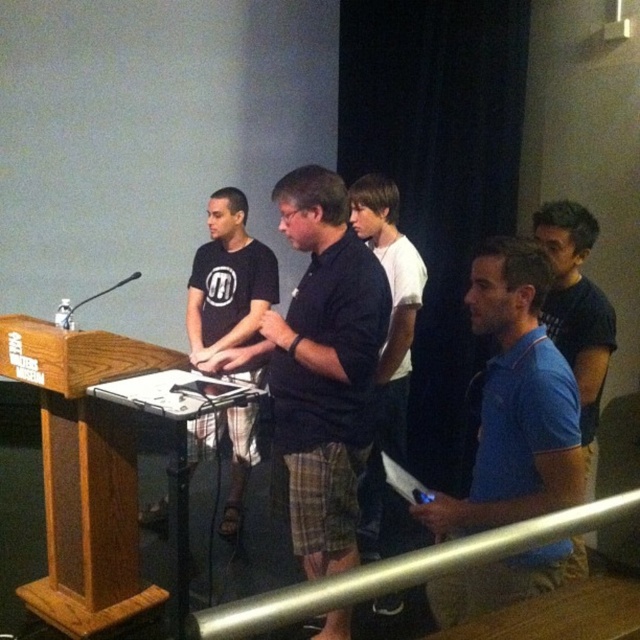
You are standing in the conference room and want to walk to the podium. There is a black cotton shirt at center and a metallic silver rail at lower center in your way. Which object is closer to you?

The black cotton shirt at center is closer to you because the metallic silver rail at lower center is behind it.

You are standing in the conference room and need to move from the entrance to the podium. There is a metallic silver rail at lower center and a blue fabric shirt at right. Which object should you avoid stepping over to reach the podium safely?

You should avoid stepping over the metallic silver rail at lower center because it is located to the left of the blue fabric shirt at right, meaning it is closer to your path towards the podium.